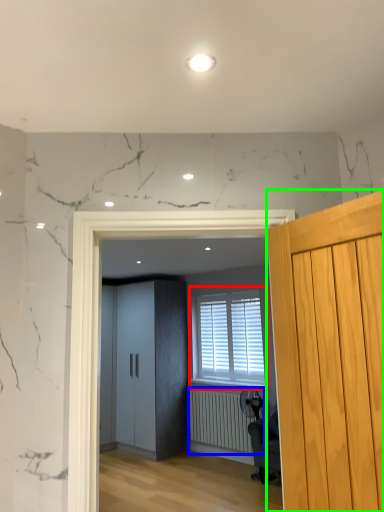
Question: Based on their relative distances, which object is farther from window (highlighted by a red box)? Choose from radiator (highlighted by a blue box) and door (highlighted by a green box).

Choices:
 (A) radiator
 (B) door

Answer: (B)